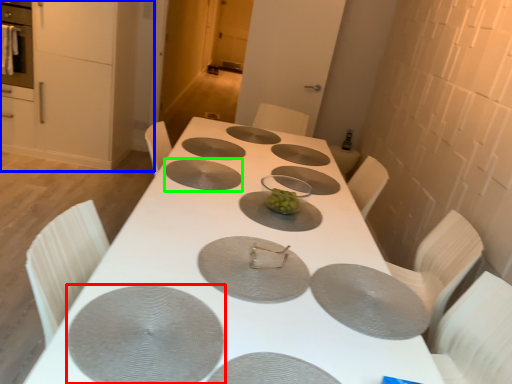
Question: Which object is positioned farthest from pizza pan (highlighted by a red box)? Select from cabinetry (highlighted by a blue box) and pizza pan (highlighted by a green box).

Choices:
 (A) cabinetry
 (B) pizza pan

Answer: (A)